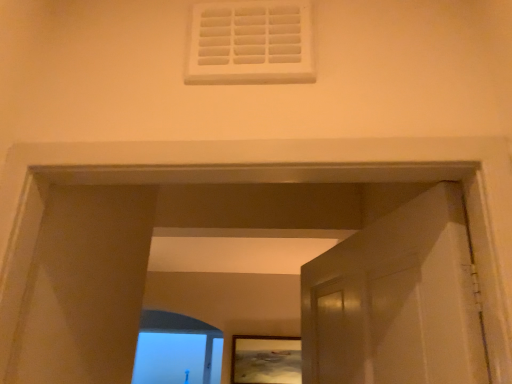
Question: Can you confirm if matte wooden picture frame at center is bigger than clear glass window frame at lower left?

Choices:
 (A) yes
 (B) no

Answer: (B)

Question: Is matte wooden picture frame at center oriented towards clear glass window frame at lower left?

Choices:
 (A) yes
 (B) no

Answer: (B)

Question: Is matte wooden picture frame at center taller than clear glass window frame at lower left?

Choices:
 (A) yes
 (B) no

Answer: (B)

Question: Can we say matte wooden picture frame at center lies outside clear glass window frame at lower left?

Choices:
 (A) no
 (B) yes

Answer: (B)

Question: From a real-world perspective, is matte wooden picture frame at center on top of clear glass window frame at lower left?

Choices:
 (A) no
 (B) yes

Answer: (B)

Question: From a real-world perspective, is matte wooden picture frame at center under clear glass window frame at lower left?

Choices:
 (A) yes
 (B) no

Answer: (B)

Question: Does clear glass window frame at lower left come behind matte wooden picture frame at center?

Choices:
 (A) no
 (B) yes

Answer: (B)

Question: Is clear glass window frame at lower left positioned with its back to matte wooden picture frame at center?

Choices:
 (A) yes
 (B) no

Answer: (B)

Question: Is clear glass window frame at lower left outside matte wooden picture frame at center?

Choices:
 (A) yes
 (B) no

Answer: (A)

Question: Does clear glass window frame at lower left have a larger size compared to matte wooden picture frame at center?

Choices:
 (A) yes
 (B) no

Answer: (A)

Question: Is clear glass window frame at lower left thinner than matte wooden picture frame at center?

Choices:
 (A) yes
 (B) no

Answer: (B)

Question: Could you tell me if clear glass window frame at lower left is facing matte wooden picture frame at center?

Choices:
 (A) no
 (B) yes

Answer: (B)

Question: In the image, is clear glass window frame at lower left positioned in front of or behind matte wooden picture frame at center?

Choices:
 (A) behind
 (B) front

Answer: (A)